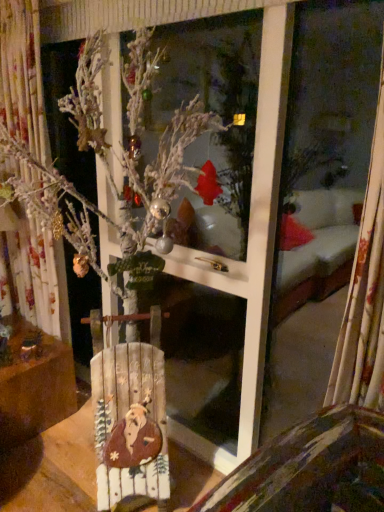
Question: In the image, is wooden sign at lower left on the left side or the right side of wooden sign at center?

Choices:
 (A) left
 (B) right

Answer: (A)

Question: In terms of height, does wooden sign at lower left look taller or shorter compared to wooden sign at center?

Choices:
 (A) short
 (B) tall

Answer: (A)

Question: Considering the positions of wooden sign at lower left and wooden sign at center in the image, is wooden sign at lower left wider or thinner than wooden sign at center?

Choices:
 (A) thin
 (B) wide

Answer: (B)

Question: Is wooden sign at center to the left or to the right of wooden sign at lower left in the image?

Choices:
 (A) right
 (B) left

Answer: (A)

Question: In terms of height, does wooden sign at center look taller or shorter compared to wooden sign at lower left?

Choices:
 (A) short
 (B) tall

Answer: (B)

Question: Is point (117, 435) closer or farther from the camera than point (26, 378)?

Choices:
 (A) farther
 (B) closer

Answer: (B)

Question: From the image's perspective, is wooden sign at center above or below wooden sign at lower left?

Choices:
 (A) below
 (B) above

Answer: (B)